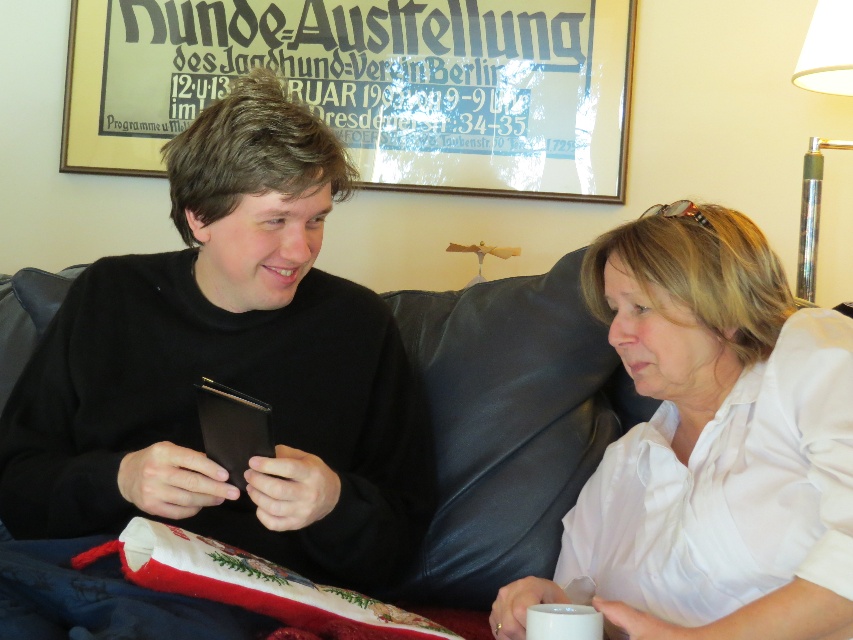
Question: Can you confirm if black matte wallet at left is thinner than white cotton shirt at upper right?

Choices:
 (A) yes
 (B) no

Answer: (B)

Question: Does black matte wallet at left lie behind white cotton shirt at upper right?

Choices:
 (A) yes
 (B) no

Answer: (A)

Question: Which of the following is the farthest from the observer?

Choices:
 (A) black matte wallet at left
 (B) white cotton shirt at upper right

Answer: (A)

Question: Can you confirm if black matte wallet at left is bigger than white cotton shirt at upper right?

Choices:
 (A) yes
 (B) no

Answer: (A)

Question: Which object appears closest to the camera in this image?

Choices:
 (A) white cotton shirt at upper right
 (B) black matte wallet at left

Answer: (A)